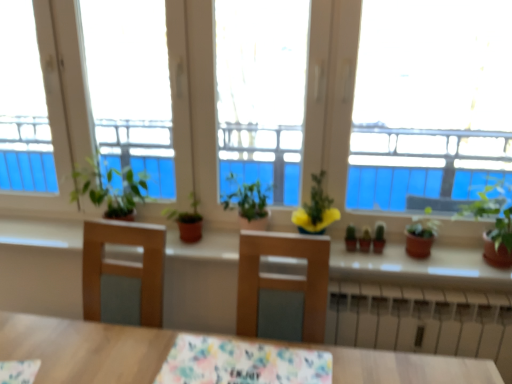
At what (x,y) coordinates should I click in order to perform the action: click on vacant region to the right of green matte plant at center, the first houseplant when ordered from left to right. Please return your answer as a coordinate pair (x, y). This screenshot has width=512, height=384. Looking at the image, I should click on (216, 240).